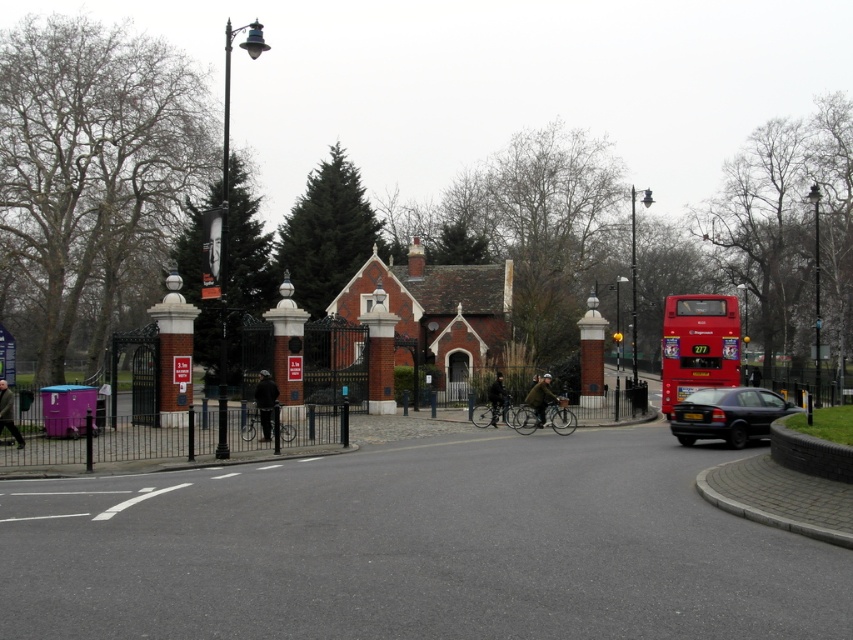
Question: Is red metallic bus at right behind black matte sedan at lower right?

Choices:
 (A) yes
 (B) no

Answer: (A)

Question: Is red metallic bus at right below black matte sedan at lower right?

Choices:
 (A) yes
 (B) no

Answer: (B)

Question: Which point is farther to the camera?

Choices:
 (A) tap(718, 413)
 (B) tap(718, 355)

Answer: (B)

Question: Does red metallic bus at right have a greater width compared to black matte sedan at lower right?

Choices:
 (A) yes
 (B) no

Answer: (A)